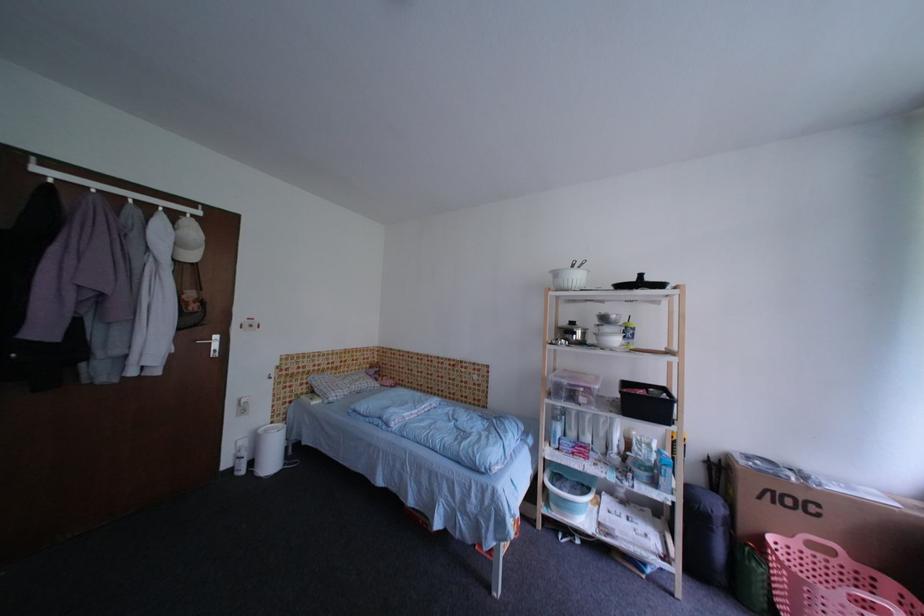
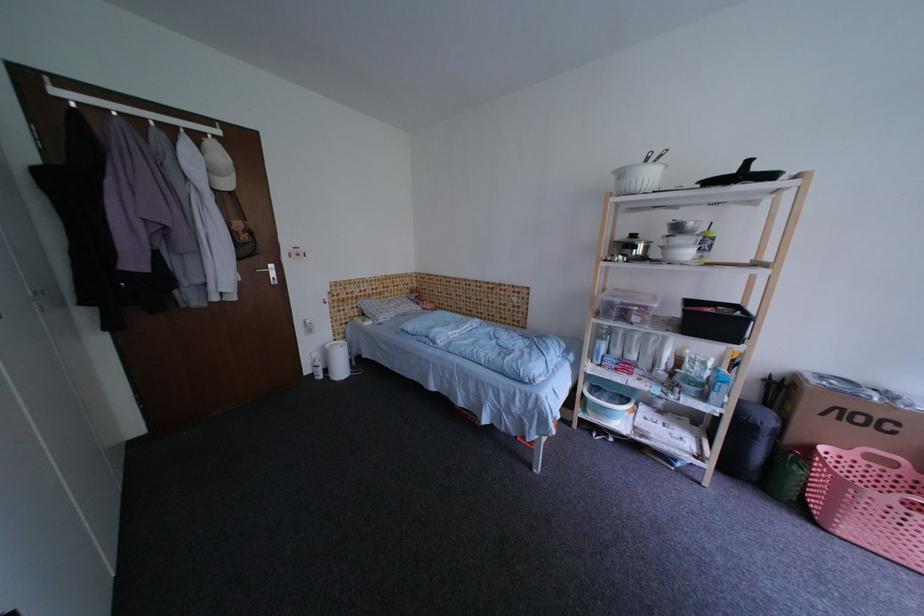
Where in the second image is the point corresponding to point (234, 467) from the first image?

(314, 374)